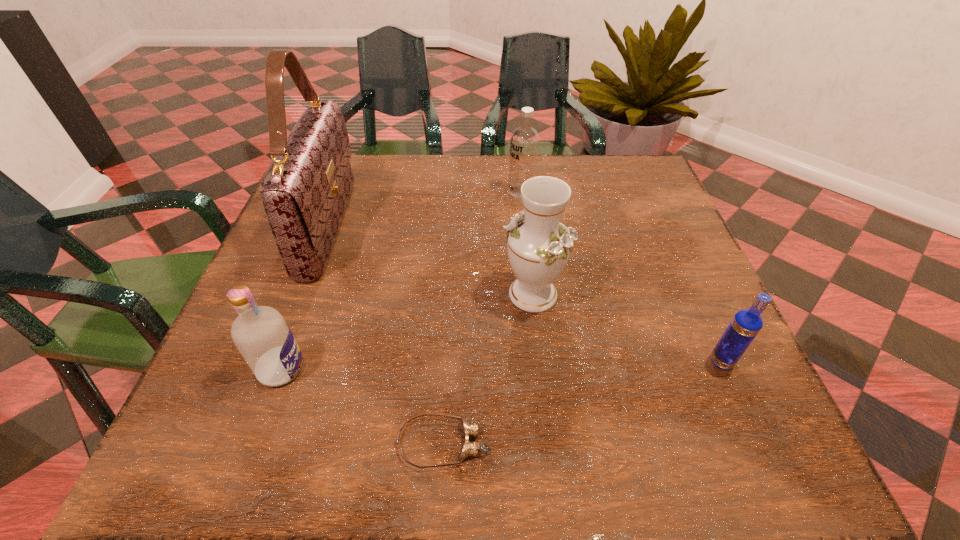
Where is `object that stands as the second closest to the vase`? object that stands as the second closest to the vase is located at coordinates (746, 324).

Select which object is the fourth closest to the vase. Please provide its 2D coordinates. Your answer should be formatted as a tuple, i.e. [(x, y)], where the tuple contains the x and y coordinates of a point satisfying the conditions above.

[(305, 191)]

Select which vodka appears as the closest to the vase. Please provide its 2D coordinates. Your answer should be formatted as a tuple, i.e. [(x, y)], where the tuple contains the x and y coordinates of a point satisfying the conditions above.

[(746, 324)]

This screenshot has width=960, height=540. What are the coordinates of `vodka object that ranks as the second closest to the fourth object from right to left` in the screenshot? It's located at (746, 324).

Identify the location of free space that satisfies the following two spatial constraints: 1. on the front side of the shortest vodka; 2. on the right side of the vase. Image resolution: width=960 pixels, height=540 pixels. (540, 362).

Image resolution: width=960 pixels, height=540 pixels. Identify the location of free space that satisfies the following two spatial constraints: 1. on the front side of the vase; 2. on the label of the leftmost vodka. (541, 369).

Find the location of a particular element. The image size is (960, 540). free point that satisfies the following two spatial constraints: 1. on the front side of the vase; 2. on the front lenses and sides of the third object from left to right is located at coordinates (549, 443).

Where is `free location that satisfies the following two spatial constraints: 1. on the front label of the second vodka from right to left; 2. on the back side of the rightmost vodka`? free location that satisfies the following two spatial constraints: 1. on the front label of the second vodka from right to left; 2. on the back side of the rightmost vodka is located at coordinates (540, 362).

The width and height of the screenshot is (960, 540). What are the coordinates of `free space that satisfies the following two spatial constraints: 1. on the front label of the rightmost object; 2. on the right side of the farthest vodka` in the screenshot? It's located at (540, 362).

Identify the location of blank space that satisfies the following two spatial constraints: 1. on the front label of the farthest vodka; 2. on the back side of the vase. (533, 294).